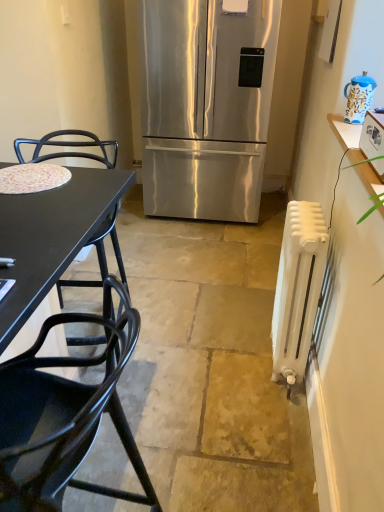
Measure the distance between stainless steel refrigerator at center and camera.

They are 2.54 meters apart.

The height and width of the screenshot is (512, 384). What do you see at coordinates (359, 97) in the screenshot?
I see `blue and white ceramic teapot at upper right` at bounding box center [359, 97].

This screenshot has width=384, height=512. Identify the location of blue and white ceramic teapot at upper right. pos(359,97).

This screenshot has width=384, height=512. What do you see at coordinates (68, 146) in the screenshot?
I see `black metal chair at left, the first chair positioned from the back` at bounding box center [68, 146].

Identify the location of stainless steel refrigerator at center. Image resolution: width=384 pixels, height=512 pixels. (205, 105).

From the image's perspective, would you say blue and white ceramic teapot at upper right is positioned over black matte chair at lower left, the 1th chair viewed from the front?

Correct, blue and white ceramic teapot at upper right appears higher than black matte chair at lower left, the 1th chair viewed from the front, in the image.

From a real-world perspective, between blue and white ceramic teapot at upper right and black matte chair at lower left, which is counted as the 2th chair, starting from the back, who is vertically higher?

From a 3D spatial view, blue and white ceramic teapot at upper right is above.

Between blue and white ceramic teapot at upper right and black matte chair at lower left, which is counted as the 2th chair, starting from the back, which one has larger width?

With larger width is black matte chair at lower left, which is counted as the 2th chair, starting from the back.

Is stainless steel refrigerator at center facing towards black metal chair at left, which appears as the second chair when viewed from the front?

Yes, stainless steel refrigerator at center is aimed at black metal chair at left, which appears as the second chair when viewed from the front.

Is point (228, 213) less distant than point (101, 245)?

No, (228, 213) is behind (101, 245).

Looking at this image, which of these two, stainless steel refrigerator at center or black metal chair at left, which appears as the second chair when viewed from the front, is wider?

With larger width is stainless steel refrigerator at center.

From a real-world perspective, who is located higher, black metal chair at left, which appears as the second chair when viewed from the front, or stainless steel refrigerator at center?

stainless steel refrigerator at center is physically above.

Could you measure the distance between black metal chair at left, which appears as the second chair when viewed from the front, and stainless steel refrigerator at center?

black metal chair at left, which appears as the second chair when viewed from the front, is 91.86 centimeters away from stainless steel refrigerator at center.

Could you tell me if black metal chair at left, the first chair positioned from the back, is facing stainless steel refrigerator at center?

No, black metal chair at left, the first chair positioned from the back, is not turned towards stainless steel refrigerator at center.

Is point (91, 239) positioned after point (246, 81)?

No, (91, 239) is in front of (246, 81).

Is white plastic toaster at upper right next to white matte radiator at right?

No, white plastic toaster at upper right is not with white matte radiator at right.

Can you confirm if white plastic toaster at upper right is positioned to the right of white matte radiator at right?

Correct, you'll find white plastic toaster at upper right to the right of white matte radiator at right.

Is white plastic toaster at upper right oriented towards white matte radiator at right?

No.

Is point (379, 138) positioned after point (306, 293)?

No.

Who is taller, blue and white ceramic teapot at upper right or stainless steel refrigerator at center?

stainless steel refrigerator at center.

Is blue and white ceramic teapot at upper right wider or thinner than stainless steel refrigerator at center?

Clearly, blue and white ceramic teapot at upper right has less width compared to stainless steel refrigerator at center.

Is blue and white ceramic teapot at upper right oriented away from stainless steel refrigerator at center?

blue and white ceramic teapot at upper right is not turned away from stainless steel refrigerator at center.

In the scene shown: Do you think blue and white ceramic teapot at upper right is within stainless steel refrigerator at center, or outside of it?

blue and white ceramic teapot at upper right exists outside the volume of stainless steel refrigerator at center.

Based on their sizes in the image, would you say stainless steel refrigerator at center is bigger or smaller than white matte radiator at right?

stainless steel refrigerator at center is bigger than white matte radiator at right.

Between stainless steel refrigerator at center and white matte radiator at right, which one has larger width?

stainless steel refrigerator at center is wider.

Is stainless steel refrigerator at center positioned with its back to white matte radiator at right?

No.

Which is farther, (x=85, y=141) or (x=357, y=97)?

Positioned behind is point (x=85, y=141).

Does black metal chair at left, the first chair positioned from the back, come in front of blue and white ceramic teapot at upper right?

Yes, it is.

Which is more to the left, black metal chair at left, which appears as the second chair when viewed from the front, or blue and white ceramic teapot at upper right?

From the viewer's perspective, black metal chair at left, which appears as the second chair when viewed from the front, appears more on the left side.

Is black metal chair at left, which appears as the second chair when viewed from the front, spatially inside blue and white ceramic teapot at upper right, or outside of it?

black metal chair at left, which appears as the second chair when viewed from the front, lies outside blue and white ceramic teapot at upper right.

From the image's perspective, which chair is the 2nd one below the blue and white ceramic teapot at upper right? Please provide its 2D coordinates.

[(65, 412)]

In order to click on refrigerator above the black metal chair at left, the first chair positioned from the back (from the image's perspective) in this screenshot , I will do `click(205, 105)`.

When comparing their distances from stainless steel refrigerator at center, does black metal chair at left, the first chair positioned from the back, or white matte radiator at right seem further?

white matte radiator at right is further to stainless steel refrigerator at center.

Looking at this image, from the image, which object appears to be nearer to stainless steel refrigerator at center, white matte radiator at right or white plastic toaster at upper right?

white matte radiator at right.

Considering their positions, is stainless steel refrigerator at center positioned further to black metal chair at left, the first chair positioned from the back, than white matte radiator at right?

white matte radiator at right.

Estimate the real-world distances between objects in this image. Which object is closer to white plastic toaster at upper right, blue and white ceramic teapot at upper right or black metal chair at left, the first chair positioned from the back?

blue and white ceramic teapot at upper right lies closer to white plastic toaster at upper right than the other object.

Looking at the image, which one is located closer to black metal chair at left, the first chair positioned from the back, white matte radiator at right or white plastic toaster at upper right?

white matte radiator at right lies closer to black metal chair at left, the first chair positioned from the back, than the other object.

Considering their positions, is stainless steel refrigerator at center positioned closer to blue and white ceramic teapot at upper right than white matte radiator at right?

Based on the image, white matte radiator at right appears to be nearer to blue and white ceramic teapot at upper right.

When comparing their distances from white matte radiator at right, does stainless steel refrigerator at center or white plastic toaster at upper right seem further?

Among the two, stainless steel refrigerator at center is located further to white matte radiator at right.

Looking at the image, which one is located closer to black matte chair at lower left, which is counted as the 2th chair, starting from the back, blue and white ceramic teapot at upper right or black metal chair at left, which appears as the second chair when viewed from the front?

black metal chair at left, which appears as the second chair when viewed from the front, is positioned closer to the anchor black matte chair at lower left, which is counted as the 2th chair, starting from the back.

Identify the location of chair between black matte chair at lower left, which is counted as the 2th chair, starting from the back, and white matte radiator at right in the front-back direction. (68, 146).

Find the location of a particular element. This screenshot has height=512, width=384. radiator positioned between black matte chair at lower left, the 1th chair viewed from the front, and blue and white ceramic teapot at upper right from near to far is located at coordinates (298, 289).

Locate an element on the screen. chair located between black matte chair at lower left, the 1th chair viewed from the front, and stainless steel refrigerator at center in the depth direction is located at coordinates (68, 146).

Image resolution: width=384 pixels, height=512 pixels. Identify the location of kitchen appliance between black matte chair at lower left, which is counted as the 2th chair, starting from the back, and stainless steel refrigerator at center, along the z-axis. (372, 135).